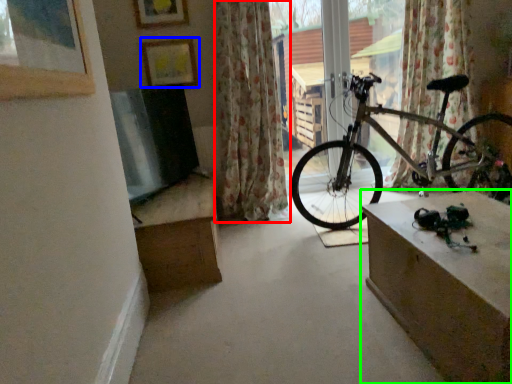
Question: Considering the real-world distances, which object is farthest from curtain (highlighted by a red box)? picture frame (highlighted by a blue box) or table (highlighted by a green box)?

Choices:
 (A) picture frame
 (B) table

Answer: (B)